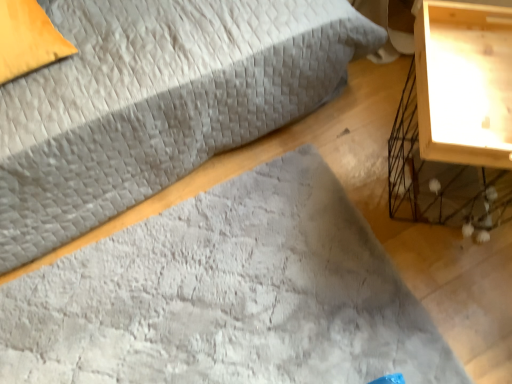
Question: Can you confirm if wooden nightstand at right is thinner than velvet gray bed at center?

Choices:
 (A) no
 (B) yes

Answer: (B)

Question: Is the depth of wooden nightstand at right less than that of velvet gray bed at center?

Choices:
 (A) yes
 (B) no

Answer: (B)

Question: Can you confirm if wooden nightstand at right is wider than velvet gray bed at center?

Choices:
 (A) yes
 (B) no

Answer: (B)

Question: From a real-world perspective, is wooden nightstand at right over velvet gray bed at center?

Choices:
 (A) yes
 (B) no

Answer: (B)

Question: Does wooden nightstand at right appear on the right side of velvet gray bed at center?

Choices:
 (A) yes
 (B) no

Answer: (A)

Question: Considering the positions of textured gray mat at center and velvet gray bed at center in the image, is textured gray mat at center wider or thinner than velvet gray bed at center?

Choices:
 (A) wide
 (B) thin

Answer: (B)

Question: Considering their positions, is textured gray mat at center located in front of or behind velvet gray bed at center?

Choices:
 (A) front
 (B) behind

Answer: (B)

Question: In terms of size, does textured gray mat at center appear bigger or smaller than velvet gray bed at center?

Choices:
 (A) small
 (B) big

Answer: (A)

Question: From the image's perspective, relative to velvet gray bed at center, is textured gray mat at center above or below?

Choices:
 (A) above
 (B) below

Answer: (B)

Question: In terms of width, does velvet gray bed at center look wider or thinner when compared to textured gray mat at center?

Choices:
 (A) thin
 (B) wide

Answer: (B)

Question: Is point (266, 114) positioned closer to the camera than point (426, 347)?

Choices:
 (A) farther
 (B) closer

Answer: (A)

Question: From the image's perspective, relative to textured gray mat at center, is velvet gray bed at center above or below?

Choices:
 (A) above
 (B) below

Answer: (A)

Question: Is velvet gray bed at center taller or shorter than textured gray mat at center?

Choices:
 (A) short
 (B) tall

Answer: (B)

Question: From the image's perspective, is velvet gray bed at center positioned above or below wooden nightstand at right?

Choices:
 (A) above
 (B) below

Answer: (A)

Question: From a real-world perspective, is velvet gray bed at center positioned above or below wooden nightstand at right?

Choices:
 (A) below
 (B) above

Answer: (B)